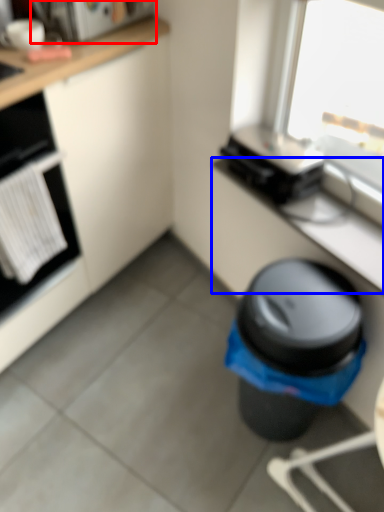
Question: Among these objects, which one is nearest to the camera, appliance (highlighted by a red box) or counter top (highlighted by a blue box)?

Choices:
 (A) appliance
 (B) counter top

Answer: (B)